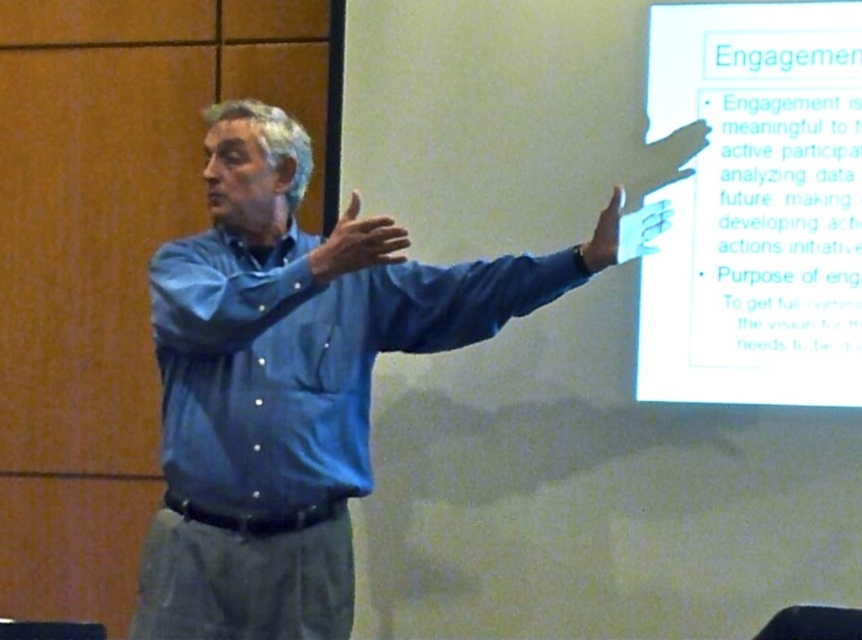
You are an attendee in the conference room. You see the speaker wearing a matte blue shirt at center and another attendee wearing a matte blue shirt at upper right. Which person is closer to the left side of the room?

The speaker wearing the matte blue shirt at center is closer to the left side of the room because the matte blue shirt at center is to the left of the matte blue shirt at upper right.

You are a photographer setting up for a presentation. You need to place a small light between the two points, point (355, 256) and point (611, 225). Which point should the light be closer to if you want it to appear larger in the photo?

The light should be placed closer to point (355, 256) because it is closer to the camera, making it appear larger in the photo.